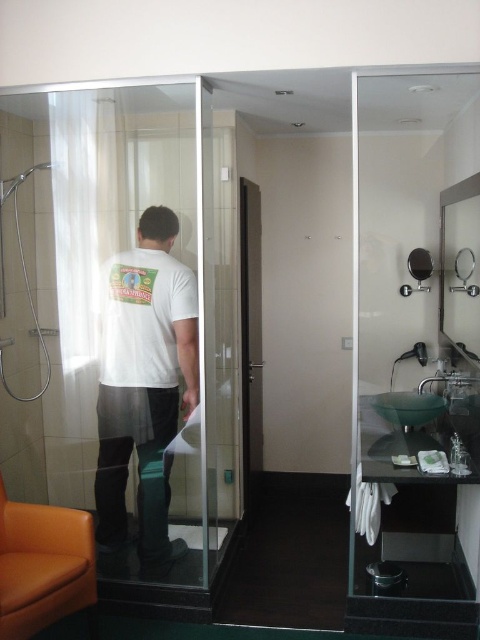
Does white matte t-shirt at center appear on the right side of matte black mirror at upper right?

No, white matte t-shirt at center is not to the right of matte black mirror at upper right.

Measure the distance from white matte t-shirt at center to matte black mirror at upper right.

white matte t-shirt at center and matte black mirror at upper right are 1.81 meters apart from each other.

Who is more distant from viewer, (145, 440) or (410, 291)?

The point (410, 291) is more distant.

Find the location of a particular element. This screenshot has height=640, width=480. white matte t-shirt at center is located at coordinates (144, 385).

Can you confirm if transparent glass door at center is positioned above matte black mirror at upper right?

Actually, transparent glass door at center is below matte black mirror at upper right.

Does transparent glass door at center have a smaller size compared to matte black mirror at upper right?

No, transparent glass door at center is not smaller than matte black mirror at upper right.

Who is more forward, (13,326) or (420,280)?

Positioned in front is point (13,326).

Locate an element on the screen. transparent glass door at center is located at coordinates (121, 328).

Does transparent glass door at center lie in front of white matte t-shirt at center?

That is True.

Does point (212, 392) come closer to viewer compared to point (164, 508)?

Yes.

Which is in front, point (232, 324) or point (165, 307)?

Positioned in front is point (165, 307).

Identify the location of transparent glass door at center. (121, 328).